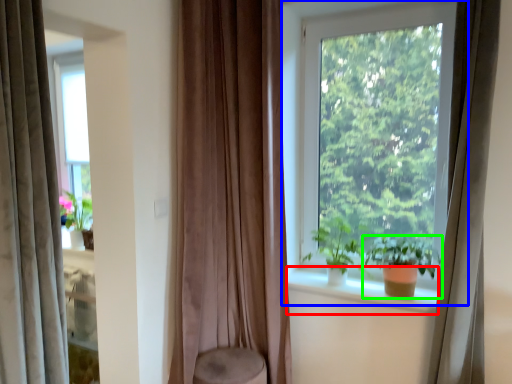
Question: Estimate the real-world distances between objects in this image. Which object is farther from window sill (highlighted by a red box), window (highlighted by a blue box) or houseplant (highlighted by a green box)?

Choices:
 (A) window
 (B) houseplant

Answer: (A)